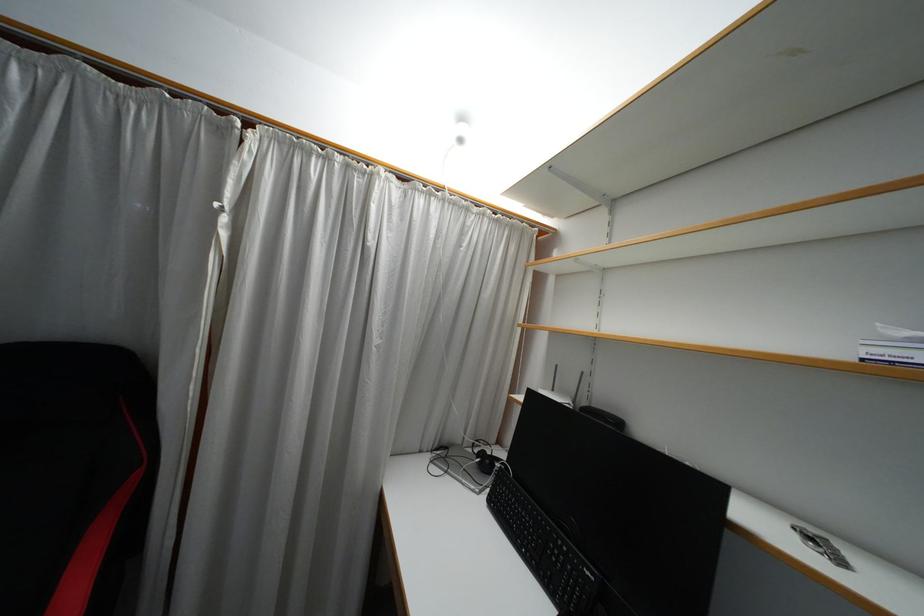
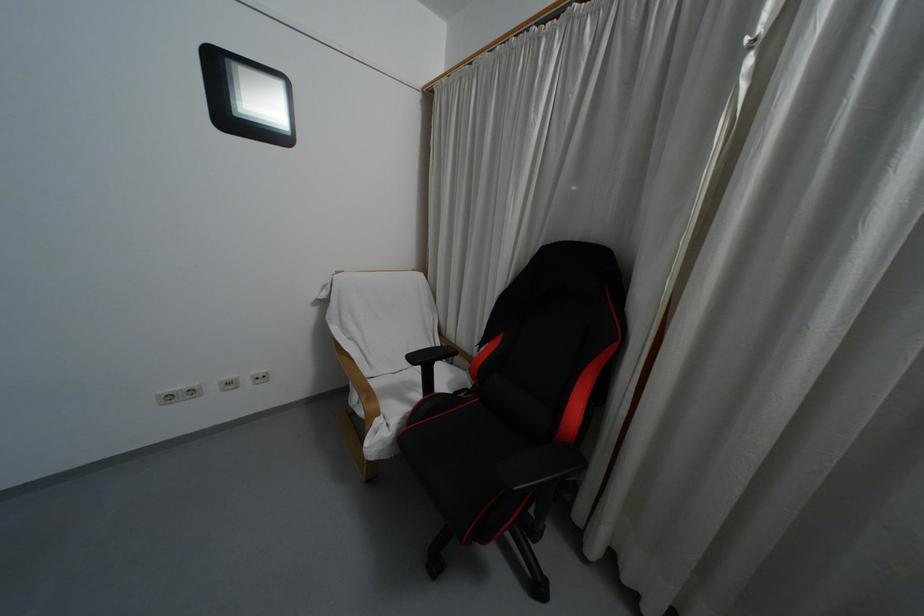
Question: Based on the continuous images, in which direction is the camera rotating? Reply with the corresponding letter.

Choices:
 (A) Left
 (B) Right
 (C) Up
 (D) Down

Answer: (A)